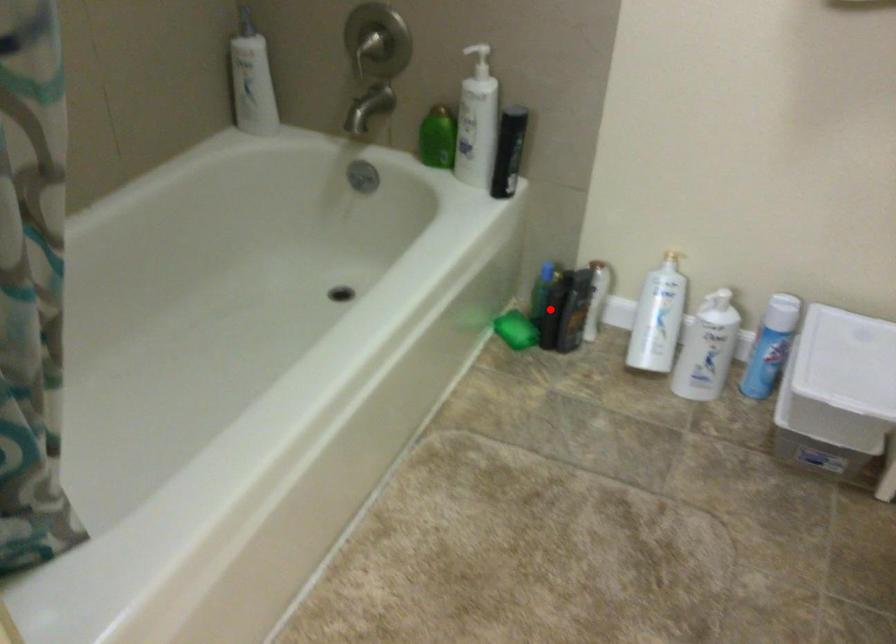
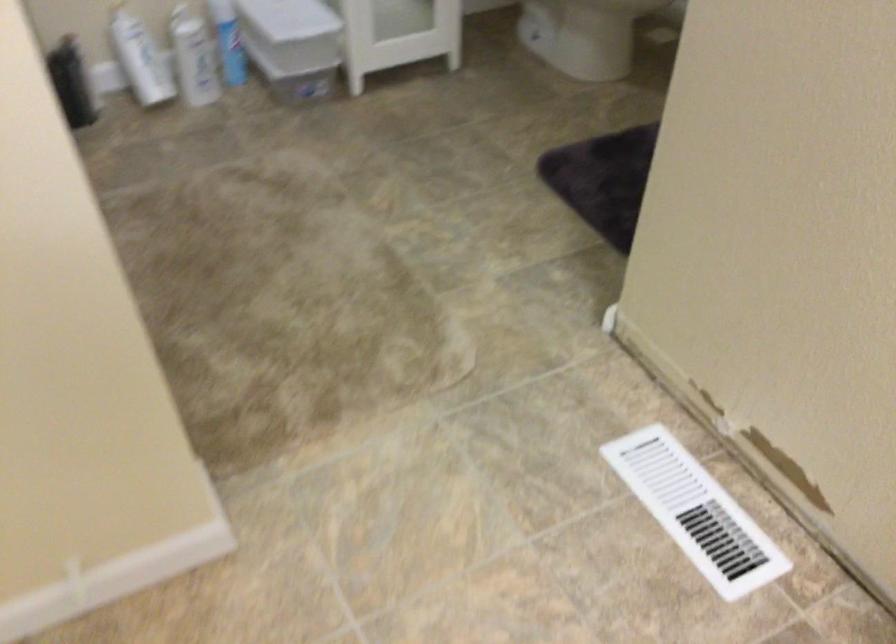
Find the pixel in the second image that matches the highlighted location in the first image.

(72, 82)